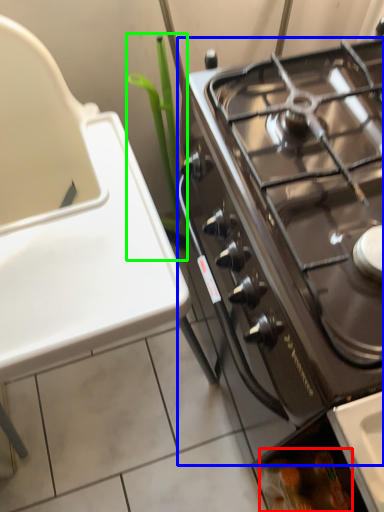
Question: Which object is the farthest from food (highlighted by a red box)? Choose among these: gas stove (highlighted by a blue box) or plant (highlighted by a green box).

Choices:
 (A) gas stove
 (B) plant

Answer: (B)